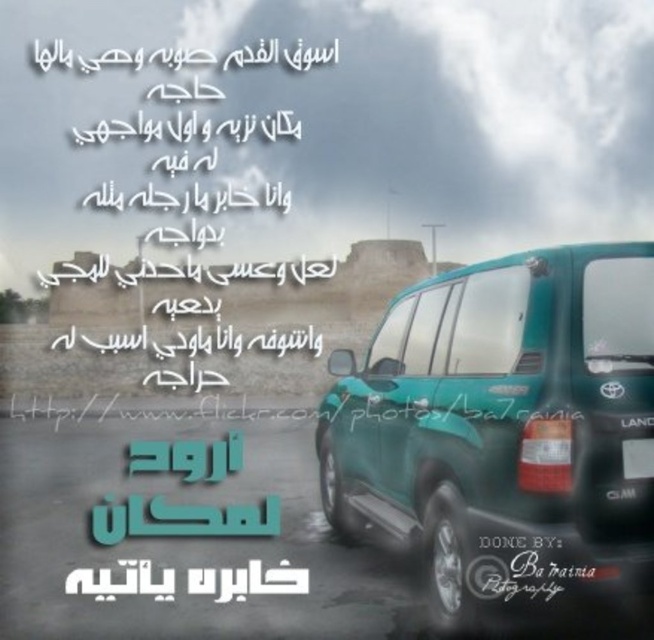
Question: Does teal glossy suv at center appear over green plastic license plate at lower right?

Choices:
 (A) yes
 (B) no

Answer: (B)

Question: Which point is closer to the camera?

Choices:
 (A) green plastic license plate at lower right
 (B) teal glossy suv at center

Answer: (B)

Question: Where is teal glossy suv at center located in relation to green plastic license plate at lower right in the image?

Choices:
 (A) below
 (B) above

Answer: (A)

Question: Can you confirm if teal glossy suv at center is positioned to the right of green plastic license plate at lower right?

Choices:
 (A) yes
 (B) no

Answer: (B)